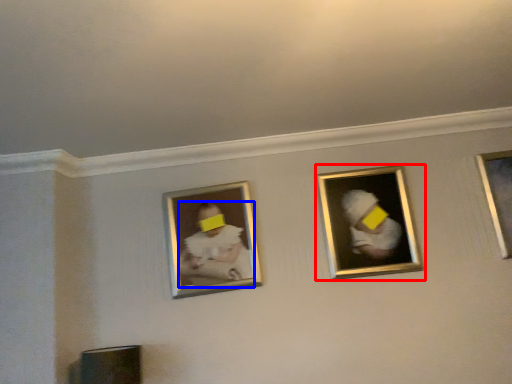
Question: Which point is closer to the camera, picture frame (highlighted by a red box) or person (highlighted by a blue box)?

Choices:
 (A) picture frame
 (B) person

Answer: (A)